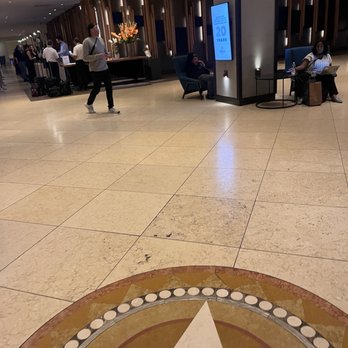
Image resolution: width=348 pixels, height=348 pixels. I want to click on tile floor, so click(163, 161).